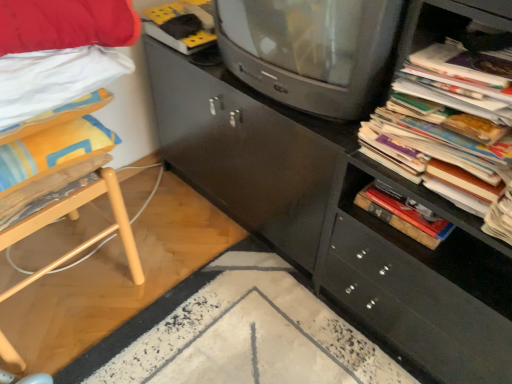
Identify the location of vacant area that is situated to the right of light wood chair at left. (190, 289).